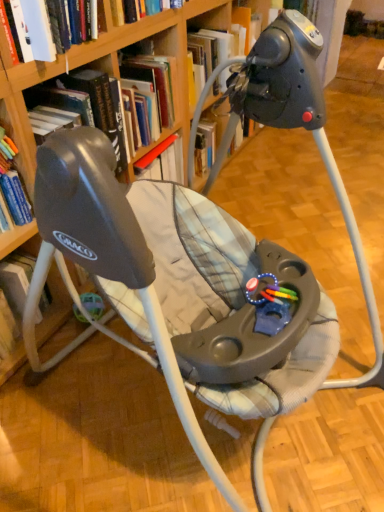
You are a GUI agent. You are given a task and a screenshot of the screen. Output one action in this format:
    pyautogui.click(x=<x>, y=<y>)
    Task: Click on the wooden bookcase at upper center
    Image resolution: width=384 pixels, height=512 pixels.
    Given the screenshot: What is the action you would take?
    pyautogui.click(x=20, y=98)

The width and height of the screenshot is (384, 512). Find the location of `hardcover book at upper left, which appears as the second book when viewed from the top`. hardcover book at upper left, which appears as the second book when viewed from the top is located at coordinates (87, 104).

The height and width of the screenshot is (512, 384). What do you see at coordinates (46, 27) in the screenshot? I see `hardcover book at upper center, acting as the first book starting from the top` at bounding box center [46, 27].

Locate an element on the screen. This screenshot has height=512, width=384. rubberized plastic teething toy at center is located at coordinates (270, 304).

Which of these two, hardcover book at upper center, which is the 2th book in bottom-to-top order, or hardcover book at upper left, which appears as the second book when viewed from the top, stands taller?

Standing taller between the two is hardcover book at upper left, which appears as the second book when viewed from the top.

Between hardcover book at upper center, which is the 2th book in bottom-to-top order, and hardcover book at upper left, acting as the 1th book starting from the bottom, which one has larger size?

hardcover book at upper left, acting as the 1th book starting from the bottom.

Which of these two, hardcover book at upper center, acting as the first book starting from the top, or hardcover book at upper left, acting as the 1th book starting from the bottom, is wider?

hardcover book at upper left, acting as the 1th book starting from the bottom.

Based on their positions, is wooden bookcase at upper center located to the left or right of rubberized plastic teething toy at center?

wooden bookcase at upper center is positioned on rubberized plastic teething toy at center's left side.

Between point (10, 118) and point (282, 298), which one is positioned in front?

Positioned in front is point (282, 298).

Between wooden bookcase at upper center and rubberized plastic teething toy at center, which one has smaller size?

With smaller size is rubberized plastic teething toy at center.

Consider the image. Measure the distance from wooden bookcase at upper center to rubberized plastic teething toy at center.

The distance of wooden bookcase at upper center from rubberized plastic teething toy at center is 28.67 inches.

From the image's perspective, which one is positioned higher, hardcover book at upper center, which is the 2th book in bottom-to-top order, or rubberized plastic teething toy at center?

hardcover book at upper center, which is the 2th book in bottom-to-top order, from the image's perspective.

Considering the positions of point (45, 27) and point (254, 305), is point (45, 27) closer or farther from the camera than point (254, 305)?

Point (45, 27) is farther from the camera than point (254, 305).

From the picture: Is hardcover book at upper center, acting as the first book starting from the top, with rubberized plastic teething toy at center?

They are not placed beside each other.

Locate an element on the screen. the 2nd book above the rubberized plastic teething toy at center (from the image's perspective) is located at coordinates (46, 27).

Consider the image. Could hardcover book at upper center, acting as the first book starting from the top, be considered to be inside hardcover book at upper left, acting as the 1th book starting from the bottom?

No, hardcover book at upper center, acting as the first book starting from the top, is located outside of hardcover book at upper left, acting as the 1th book starting from the bottom.

Where is `book above the hardcover book at upper left, which appears as the second book when viewed from the top (from the image's perspective)`? This screenshot has height=512, width=384. book above the hardcover book at upper left, which appears as the second book when viewed from the top (from the image's perspective) is located at coordinates (46, 27).

In the scene shown: From a real-world perspective, is hardcover book at upper left, which appears as the second book when viewed from the top, beneath hardcover book at upper center, acting as the first book starting from the top?

Yes, from a real-world perspective, hardcover book at upper left, which appears as the second book when viewed from the top, is under hardcover book at upper center, acting as the first book starting from the top.

In the scene shown: Considering their positions, is hardcover book at upper left, acting as the 1th book starting from the bottom, located in front of or behind hardcover book at upper center, acting as the first book starting from the top?

hardcover book at upper left, acting as the 1th book starting from the bottom, is positioned farther from the viewer than hardcover book at upper center, acting as the first book starting from the top.

Considering the positions of objects hardcover book at upper left, which appears as the second book when viewed from the top, and rubberized plastic teething toy at center in the image provided, who is behind, hardcover book at upper left, which appears as the second book when viewed from the top, or rubberized plastic teething toy at center?

hardcover book at upper left, which appears as the second book when viewed from the top, is more distant.

From a real-world perspective, between hardcover book at upper left, which appears as the second book when viewed from the top, and rubberized plastic teething toy at center, who is vertically higher?

hardcover book at upper left, which appears as the second book when viewed from the top, from a real-world perspective.

Can you confirm if hardcover book at upper left, acting as the 1th book starting from the bottom, is smaller than rubberized plastic teething toy at center?

Actually, hardcover book at upper left, acting as the 1th book starting from the bottom, might be larger than rubberized plastic teething toy at center.

Does rubberized plastic teething toy at center turn towards hardcover book at upper left, which appears as the second book when viewed from the top?

No, rubberized plastic teething toy at center is not oriented towards hardcover book at upper left, which appears as the second book when viewed from the top.

How distant is rubberized plastic teething toy at center from hardcover book at upper left, which appears as the second book when viewed from the top?

rubberized plastic teething toy at center and hardcover book at upper left, which appears as the second book when viewed from the top, are 29.76 inches apart.

Can you tell me how much rubberized plastic teething toy at center and hardcover book at upper left, acting as the 1th book starting from the bottom, differ in facing direction?

10.3 degrees.

Considering the positions of objects rubberized plastic teething toy at center and hardcover book at upper left, which appears as the second book when viewed from the top, in the image provided, who is more to the left, rubberized plastic teething toy at center or hardcover book at upper left, which appears as the second book when viewed from the top,?

From the viewer's perspective, hardcover book at upper left, which appears as the second book when viewed from the top, appears more on the left side.

Is rubberized plastic teething toy at center turned away from hardcover book at upper center, acting as the first book starting from the top?

That's not correct — rubberized plastic teething toy at center is not looking away from hardcover book at upper center, acting as the first book starting from the top.

From the image's perspective, is rubberized plastic teething toy at center on hardcover book at upper center, which is the 2th book in bottom-to-top order?

No.

How different are the orientations of rubberized plastic teething toy at center and hardcover book at upper center, which is the 2th book in bottom-to-top order, in degrees?

10.3 degrees.

Identify the location of toy that appears on the right of hardcover book at upper center, which is the 2th book in bottom-to-top order. The width and height of the screenshot is (384, 512). pos(270,304).

Identify the location of book in front of the hardcover book at upper left, which appears as the second book when viewed from the top. The width and height of the screenshot is (384, 512). (46, 27).

Find the location of `toy to the right of wooden bookcase at upper center`. toy to the right of wooden bookcase at upper center is located at coordinates (270, 304).

Estimate the real-world distances between objects in this image. Which object is closer to rubberized plastic teething toy at center, hardcover book at upper left, acting as the 1th book starting from the bottom, or wooden bookcase at upper center?

Based on the image, wooden bookcase at upper center appears to be nearer to rubberized plastic teething toy at center.

Looking at the image, which one is located closer to rubberized plastic teething toy at center, hardcover book at upper left, acting as the 1th book starting from the bottom, or hardcover book at upper center, which is the 2th book in bottom-to-top order?

hardcover book at upper left, acting as the 1th book starting from the bottom.

When comparing their distances from wooden bookcase at upper center, does hardcover book at upper center, acting as the first book starting from the top, or hardcover book at upper left, acting as the 1th book starting from the bottom, seem closer?

A: hardcover book at upper left, acting as the 1th book starting from the bottom, is closer to wooden bookcase at upper center.

From the picture: Based on their spatial positions, is rubberized plastic teething toy at center or hardcover book at upper left, which appears as the second book when viewed from the top, closer to hardcover book at upper center, which is the 2th book in bottom-to-top order?

hardcover book at upper left, which appears as the second book when viewed from the top, is positioned closer to the anchor hardcover book at upper center, which is the 2th book in bottom-to-top order.

Considering their positions, is hardcover book at upper left, which appears as the second book when viewed from the top, positioned closer to wooden bookcase at upper center than rubberized plastic teething toy at center?

Among the two, hardcover book at upper left, which appears as the second book when viewed from the top, is located nearer to wooden bookcase at upper center.

When comparing their distances from hardcover book at upper center, acting as the first book starting from the top, does hardcover book at upper left, acting as the 1th book starting from the bottom, or rubberized plastic teething toy at center seem further?

rubberized plastic teething toy at center lies further to hardcover book at upper center, acting as the first book starting from the top, than the other object.

Considering their positions, is hardcover book at upper center, which is the 2th book in bottom-to-top order, positioned further to rubberized plastic teething toy at center than hardcover book at upper left, acting as the 1th book starting from the bottom?

hardcover book at upper center, which is the 2th book in bottom-to-top order.

Estimate the real-world distances between objects in this image. Which object is closer to wooden bookcase at upper center, rubberized plastic teething toy at center or hardcover book at upper left, which appears as the second book when viewed from the top?

The object closer to wooden bookcase at upper center is hardcover book at upper left, which appears as the second book when viewed from the top.

Locate an element on the screen. Image resolution: width=384 pixels, height=512 pixels. book between hardcover book at upper center, which is the 2th book in bottom-to-top order, and rubberized plastic teething toy at center, in the vertical direction is located at coordinates (87, 104).

This screenshot has width=384, height=512. I want to click on bookcase between hardcover book at upper center, which is the 2th book in bottom-to-top order, and rubberized plastic teething toy at center in the up-down direction, so click(x=20, y=98).

You are a GUI agent. You are given a task and a screenshot of the screen. Output one action in this format:
    pyautogui.click(x=<x>, y=<y>)
    Task: Click on the book between wooden bookcase at upper center and hardcover book at upper left, acting as the 1th book starting from the bottom, in the front-back direction
    The image size is (384, 512).
    Given the screenshot: What is the action you would take?
    pyautogui.click(x=46, y=27)

You are a GUI agent. You are given a task and a screenshot of the screen. Output one action in this format:
    pyautogui.click(x=<x>, y=<y>)
    Task: Click on the toy between wooden bookcase at upper center and hardcover book at upper left, which appears as the second book when viewed from the top, along the z-axis
    
    Given the screenshot: What is the action you would take?
    pyautogui.click(x=270, y=304)